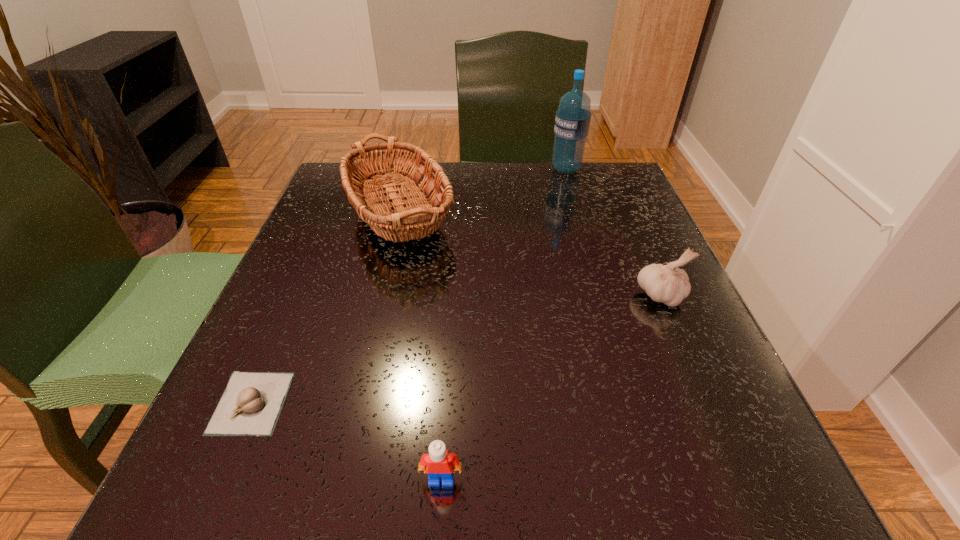
Where is `free space that satisfies the following two spatial constraints: 1. on the front side of the rightmost object; 2. on the left side of the water bottle`? free space that satisfies the following two spatial constraints: 1. on the front side of the rightmost object; 2. on the left side of the water bottle is located at coordinates (603, 295).

Where is `free location that satisfies the following two spatial constraints: 1. on the back side of the left garlic; 2. on the right side of the farther garlic`? The image size is (960, 540). free location that satisfies the following two spatial constraints: 1. on the back side of the left garlic; 2. on the right side of the farther garlic is located at coordinates (299, 295).